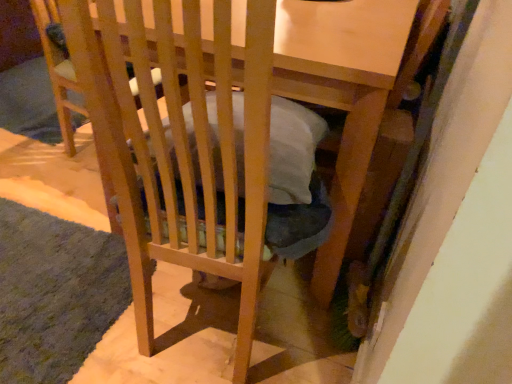
Question: Considering the relative sizes of wooden folding chair at center and green shaggy rug at lower left in the image provided, is wooden folding chair at center bigger than green shaggy rug at lower left?

Choices:
 (A) yes
 (B) no

Answer: (A)

Question: Are wooden folding chair at center and green shaggy rug at lower left far apart?

Choices:
 (A) no
 (B) yes

Answer: (A)

Question: Is wooden folding chair at center taller than green shaggy rug at lower left?

Choices:
 (A) no
 (B) yes

Answer: (B)

Question: Considering the relative sizes of wooden folding chair at center and green shaggy rug at lower left in the image provided, is wooden folding chair at center smaller than green shaggy rug at lower left?

Choices:
 (A) no
 (B) yes

Answer: (A)

Question: From a real-world perspective, is wooden folding chair at center physically above green shaggy rug at lower left?

Choices:
 (A) yes
 (B) no

Answer: (A)

Question: Is wooden folding chair at center aimed at green shaggy rug at lower left?

Choices:
 (A) yes
 (B) no

Answer: (B)

Question: From the image's perspective, is green shaggy rug at lower left on top of wooden folding chair at center?

Choices:
 (A) yes
 (B) no

Answer: (B)

Question: Considering the relative positions of green shaggy rug at lower left and wooden folding chair at center in the image provided, is green shaggy rug at lower left to the left of wooden folding chair at center from the viewer's perspective?

Choices:
 (A) yes
 (B) no

Answer: (A)

Question: Is wooden folding chair at center surrounded by green shaggy rug at lower left?

Choices:
 (A) no
 (B) yes

Answer: (A)

Question: Is the depth of green shaggy rug at lower left less than that of wooden folding chair at center?

Choices:
 (A) no
 (B) yes

Answer: (B)

Question: Is green shaggy rug at lower left facing away from wooden folding chair at center?

Choices:
 (A) yes
 (B) no

Answer: (B)

Question: Is green shaggy rug at lower left shorter than wooden folding chair at center?

Choices:
 (A) no
 (B) yes

Answer: (B)

Question: Considering the relative positions of green shaggy rug at lower left and wooden folding chair at center in the image provided, is green shaggy rug at lower left to the left or to the right of wooden folding chair at center?

Choices:
 (A) left
 (B) right

Answer: (A)